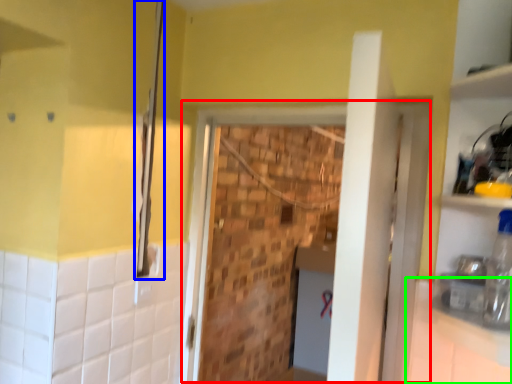
Question: Which object is positioned farthest from screen door (highlighted by a red box)? Select from shower (highlighted by a blue box) and counter top (highlighted by a green box).

Choices:
 (A) shower
 (B) counter top

Answer: (A)